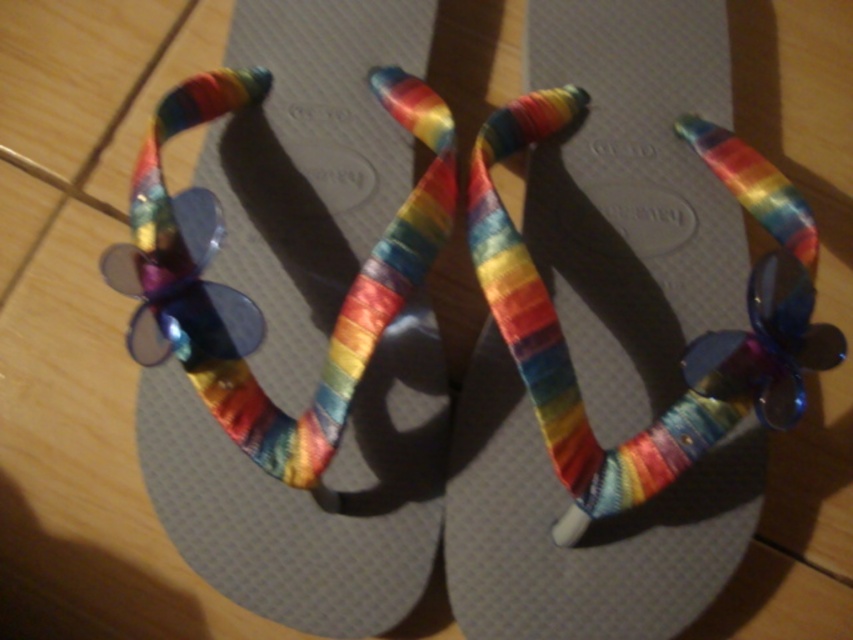
You are a designer trying to photograph the rainbow fabric sandal at center and rainbow fabric ribbon at center. To ensure the ribbon is fully visible, should you adjust the camera angle to look from above or below the current position?

The rainbow fabric ribbon at center is behind rainbow fabric sandal at center, so to ensure the ribbon is fully visible, you should adjust the camera angle to look from above the current position to avoid obstruction from the sandal.